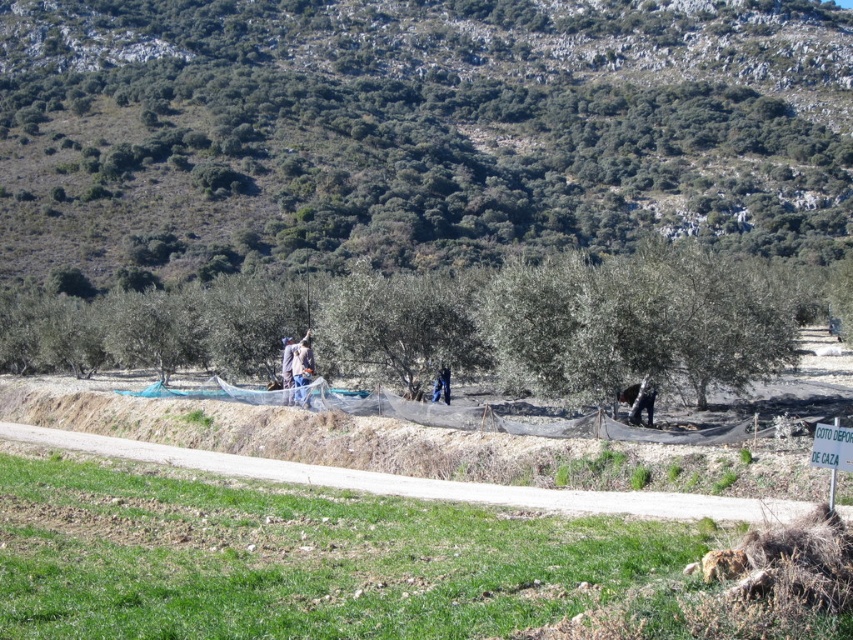
Question: Is gravel path at center closer to camera compared to blue denim jeans at center?

Choices:
 (A) yes
 (B) no

Answer: (A)

Question: Estimate the real-world distances between objects in this image. Which object is farther from the blue denim jeans at center?

Choices:
 (A) blue jeans at center
 (B) denim pants at center
 (C) gravel path at center
 (D) green leafy hillside at upper center

Answer: (D)

Question: Considering the real-world distances, which object is farthest from the green leafy hillside at upper center?

Choices:
 (A) blue jeans at center
 (B) denim pants at center
 (C) blue denim jeans at center

Answer: (C)

Question: Which object is closer to the camera taking this photo?

Choices:
 (A) blue denim jeans at center
 (B) gravel path at center
 (C) blue jeans at center
 (D) denim pants at center

Answer: (B)

Question: Is the position of denim pants at center more distant than that of blue denim jeans at center?

Choices:
 (A) yes
 (B) no

Answer: (B)

Question: Is green leafy hillside at upper center positioned behind blue jeans at center?

Choices:
 (A) yes
 (B) no

Answer: (A)